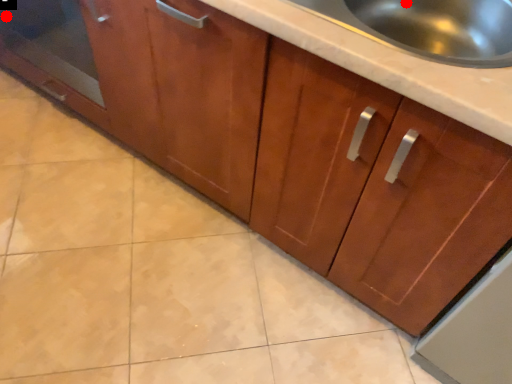
Question: Two points are circled on the image, labeled by A and B beside each circle. Which point is closer to the camera taking this photo?

Choices:
 (A) A is closer
 (B) B is closer

Answer: (A)